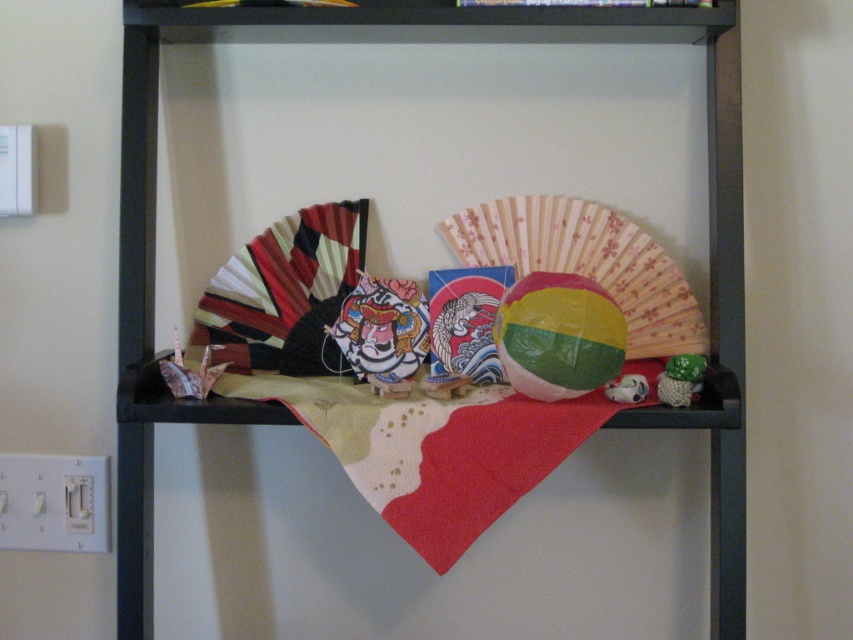
You are standing in front of the black metal shelf mounted on the wall. You notice a wooden shelf at center and a piece of fabric draped over the edge of the shelf. Which object is located at point (x=288, y=410)?

The wooden shelf at center is located at point (x=288, y=410).

You are hanging a picture frame that requires a sturdy surface. You have two options on the shelf in the image. The wooden shelf at center and the green knitted toy at right. Which object is more suitable for hanging the frame?

The wooden shelf at center is much taller than the green knitted toy at right, so it is more suitable for hanging the frame as it provides a sturdier and higher surface.